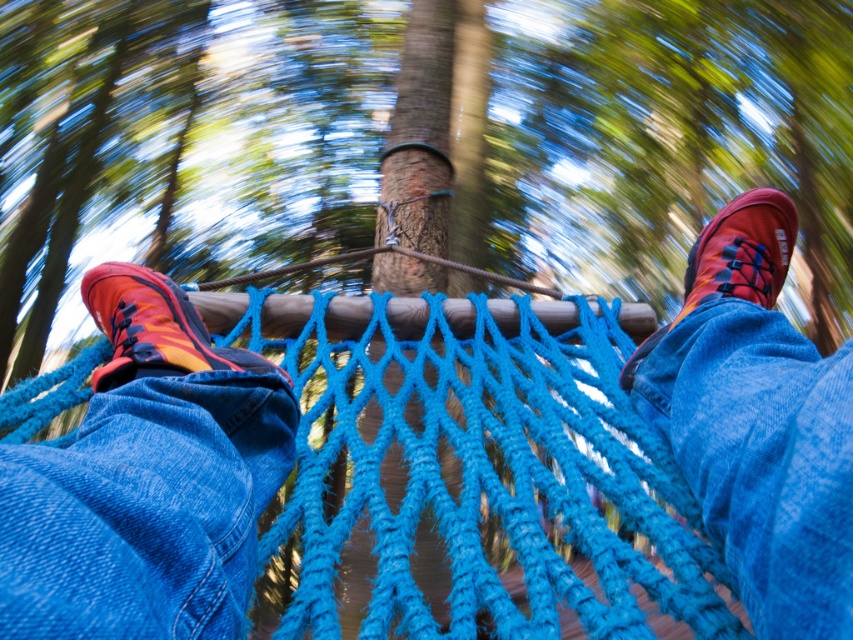
You are a hiker who wants to cross the blue yarn rope bridge at center. You notice a matte orange shoe at left nearby. Which object is higher from the ground?

The blue yarn rope bridge at center is taller than the matte orange shoe at left, so the blue yarn rope bridge at center is higher from the ground.

You are trying to locate your two hiking boots in the image. You see an orange and black hiking boot at lower left and a matte orange shoe at upper right. Which one is positioned more to the left side of the image?

The orange and black hiking boot at lower left is positioned more to the left side of the image than the matte orange shoe at upper right.